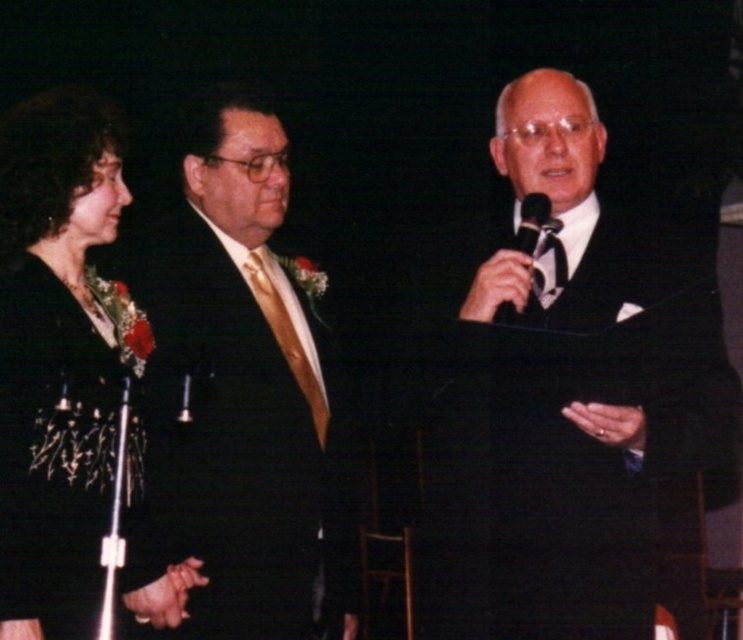
Can you confirm if shiny gold tie at center is positioned to the right of black metallic microphone at center?

No, shiny gold tie at center is not to the right of black metallic microphone at center.

In the scene shown: Which is below, shiny gold tie at center or black metallic microphone at center?

shiny gold tie at center

Image resolution: width=743 pixels, height=640 pixels. Find the location of `shiny gold tie at center`. shiny gold tie at center is located at coordinates (239, 397).

Is point (461, 227) in front of point (55, 589)?

No, it is not.

Is black silk suit at center positioned in front of black satin dress at left?

Yes.

Is point (645, 609) positioned before point (45, 376)?

No.

This screenshot has height=640, width=743. I want to click on black silk suit at center, so click(x=562, y=394).

Who is lower down, black silk suit at center or black metallic microphone at center?

black silk suit at center is below.

In the scene shown: Is black silk suit at center bigger than black metallic microphone at center?

Yes, black silk suit at center is bigger than black metallic microphone at center.

Is point (620, 282) more distant than point (536, 211)?

Yes, it is behind point (536, 211).

Where is `black silk suit at center`? Image resolution: width=743 pixels, height=640 pixels. black silk suit at center is located at coordinates [x=562, y=394].